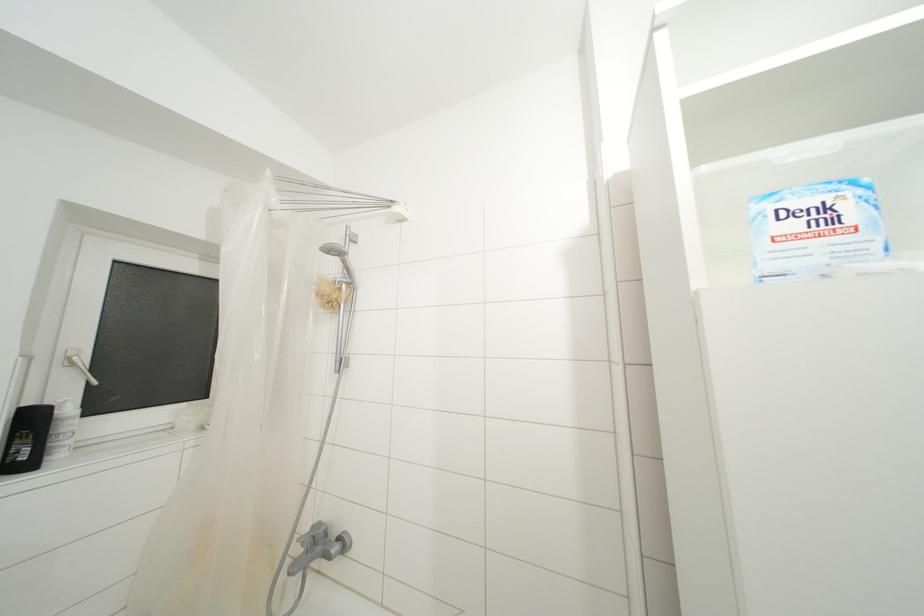
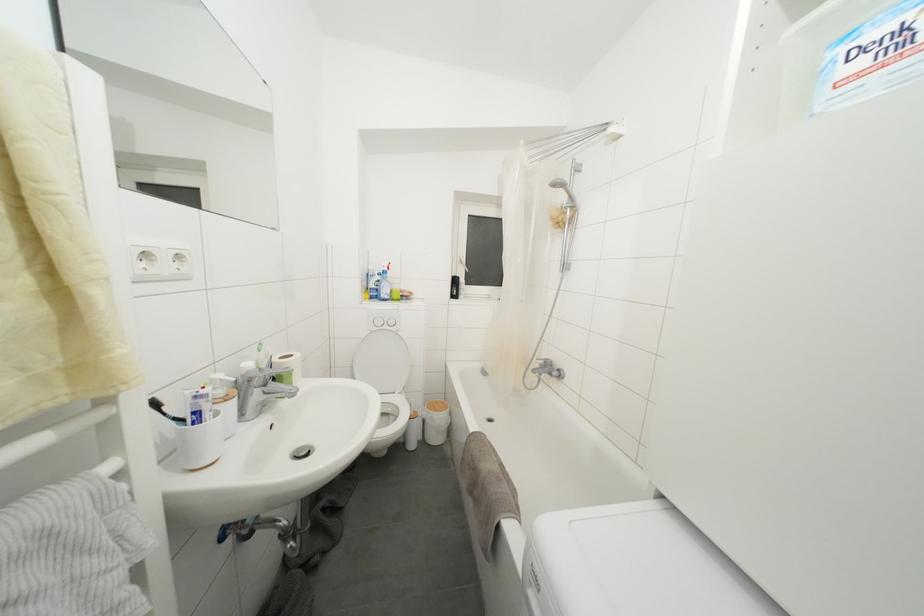
Find the pixel in the second image that matches point (351, 274) in the first image.

(575, 200)